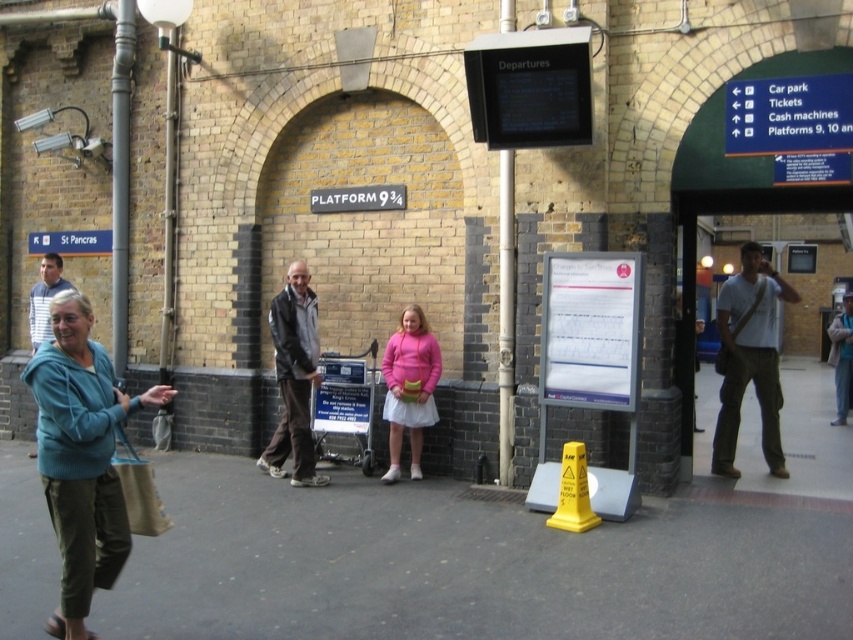
Question: Does teal fleece jacket at lower left appear over yellow plastic cone at center?

Choices:
 (A) yes
 (B) no

Answer: (A)

Question: Which object is farther from the camera taking this photo?

Choices:
 (A) silver metallic pole at center
 (B) teal fleece jacket at lower left
 (C) light blue sweater at center
 (D) light gray cotton shirt at right

Answer: (C)

Question: From the image, what is the correct spatial relationship of light gray cotton shirt at right in relation to silver metallic pole at center?

Choices:
 (A) above
 (B) below

Answer: (A)

Question: Does teal fleece jacket at lower left have a larger size compared to light gray cotton shirt at right?

Choices:
 (A) no
 (B) yes

Answer: (A)

Question: Considering the real-world distances, which object is closest to the light blue sweater at center?

Choices:
 (A) pink matte sweater at center
 (B) leather jacket at center
 (C) yellow plastic cone at center
 (D) light gray cotton shirt at right

Answer: (D)

Question: Which is farther from the gray asphalt pavement at lower center?

Choices:
 (A) pink matte sweater at center
 (B) light gray cotton shirt at right

Answer: (B)